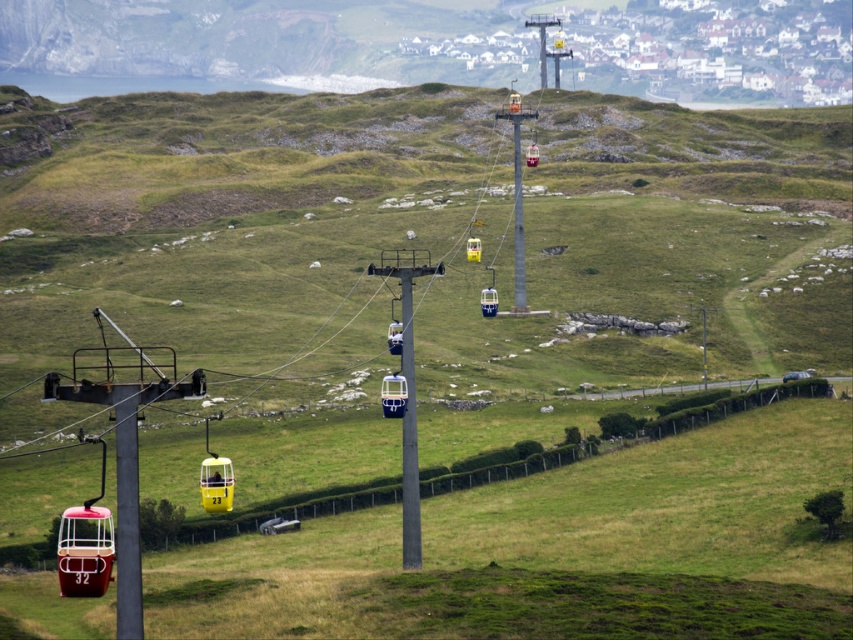
You are a tourist standing at the starting point of the cable car route and want to take the yellow plastic gondola at center. Which direction should you walk to reach it from the metallic cable car pole at left?

Since the metallic cable car pole at left is to the left of the yellow plastic gondola at center, you should walk to the right to reach the yellow plastic gondola at center from the metallic cable car pole at left.

Based on the photo, you are standing at the base of the hills and want to take a photo of both the metallic cable car at center and the yellow plastic gondola at center. Which one will appear larger in your photo?

The metallic cable car at center will appear larger in your photo because it is closer to the viewer than the yellow plastic gondola at center.